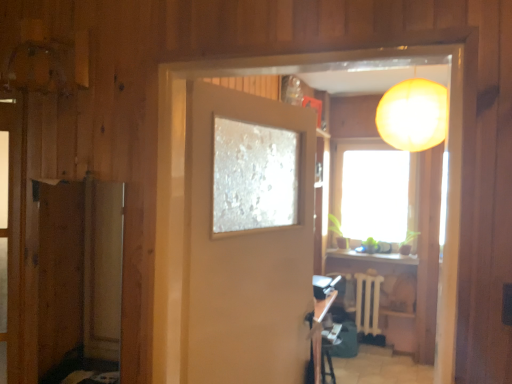
At what (x,y) coordinates should I click in order to perform the action: click on white plastic radiator at center. Please return your answer as a coordinate pair (x, y). This screenshot has width=512, height=384. Looking at the image, I should click on (367, 303).

Describe the element at coordinates (371, 190) in the screenshot. I see `transparent glass window at center` at that location.

Identify the location of wooden table at lower center. (319, 331).

Looking at their sizes, would you say matte orange lampshade at upper right is wider or thinner than wooden table at lower center?

In the image, matte orange lampshade at upper right appears to be wider than wooden table at lower center.

Is matte orange lampshade at upper right to the left or to the right of wooden table at lower center in the image?

In the image, matte orange lampshade at upper right appears on the right side of wooden table at lower center.

In terms of height, does matte orange lampshade at upper right look taller or shorter compared to wooden table at lower center?

Clearly, matte orange lampshade at upper right is taller compared to wooden table at lower center.

Looking at the image, does matte orange lampshade at upper right seem bigger or smaller compared to wooden table at lower center?

Considering their sizes, matte orange lampshade at upper right takes up more space than wooden table at lower center.

Is transparent glass window at center wider than white plastic radiator at center?

No.

Can we say transparent glass window at center lies outside white plastic radiator at center?

Yes.

From the image's perspective, who appears lower, transparent glass window at center or white plastic radiator at center?

white plastic radiator at center is shown below in the image.

Considering the points (378, 240) and (373, 331), which point is in front, point (378, 240) or point (373, 331)?

The point (373, 331) is closer.

Considering the positions of points (326, 312) and (406, 102), is point (326, 312) farther from camera compared to point (406, 102)?

Yes, it is.

From a real-world perspective, is wooden table at lower center over matte orange lampshade at upper right?

No.

Is the depth of wooden table at lower center greater than that of matte orange lampshade at upper right?

Yes, wooden table at lower center is further from the viewer.

Is wooden table at lower center looking in the opposite direction of matte orange lampshade at upper right?

No, wooden table at lower center's orientation is not away from matte orange lampshade at upper right.

From the picture: Are matte orange lampshade at upper right and wooden screen door at left located far from each other?

matte orange lampshade at upper right is far away from wooden screen door at left.

Can you confirm if matte orange lampshade at upper right is taller than wooden screen door at left?

Yes.

Does matte orange lampshade at upper right come behind wooden screen door at left?

Yes, the depth of matte orange lampshade at upper right is greater than that of wooden screen door at left.

How different are the orientations of matte orange lampshade at upper right and wooden screen door at left in degrees?

4.07 degrees.

Is wooden screen door at left facing towards white plastic radiator at center?

No, wooden screen door at left is not facing towards white plastic radiator at center.

Which object is closer to the camera, wooden screen door at left or white plastic radiator at center?

Positioned in front is wooden screen door at left.

Looking at this image, do you think wooden screen door at left is within white plastic radiator at center, or outside of it?

wooden screen door at left lies outside white plastic radiator at center.

Is wooden table at lower center far away from wooden screen door at left?

Yes, wooden table at lower center and wooden screen door at left are quite far apart.

Considering the sizes of wooden table at lower center and wooden screen door at left in the image, is wooden table at lower center wider or thinner than wooden screen door at left?

wooden table at lower center is wider than wooden screen door at left.

From a real-world perspective, does wooden table at lower center stand above wooden screen door at left?

No, from a real-world perspective, wooden table at lower center is not above wooden screen door at left.

Considering the sizes of matte orange lampshade at upper right and matte beige door at center in the image, is matte orange lampshade at upper right taller or shorter than matte beige door at center?

Considering their sizes, matte orange lampshade at upper right has less height than matte beige door at center.

Which object is positioned more to the right, matte orange lampshade at upper right or matte beige door at center?

Positioned to the right is matte orange lampshade at upper right.

Is point (431, 103) positioned before point (203, 244)?

No, it is not.

Where is `lamp to the right of wooden table at lower center`? Image resolution: width=512 pixels, height=384 pixels. lamp to the right of wooden table at lower center is located at coordinates (413, 114).

This screenshot has height=384, width=512. I want to click on radiator in front of the transparent glass window at center, so click(x=367, y=303).

When comparing their distances from wooden screen door at left, does matte orange lampshade at upper right or matte beige door at center seem closer?

matte beige door at center.

Based on their spatial positions, is wooden table at lower center or matte orange lampshade at upper right further from matte beige door at center?

→ matte orange lampshade at upper right is positioned further to the anchor matte beige door at center.

From the image, which object appears to be nearer to wooden table at lower center, transparent glass window at center or matte beige door at center?

Among the two, matte beige door at center is located nearer to wooden table at lower center.

Estimate the real-world distances between objects in this image. Which object is closer to white plastic radiator at center, wooden table at lower center or matte orange lampshade at upper right?

wooden table at lower center is positioned closer to the anchor white plastic radiator at center.

When comparing their distances from wooden screen door at left, does wooden table at lower center or transparent glass window at center seem closer?

wooden table at lower center is closer to wooden screen door at left.

Looking at the image, which one is located further to white plastic radiator at center, matte beige door at center or transparent glass window at center?

matte beige door at center lies further to white plastic radiator at center than the other object.

Estimate the real-world distances between objects in this image. Which object is closer to matte orange lampshade at upper right, wooden screen door at left or white plastic radiator at center?

The object closer to matte orange lampshade at upper right is wooden screen door at left.

Considering their positions, is matte beige door at center positioned further to wooden table at lower center than matte orange lampshade at upper right?

matte orange lampshade at upper right is further to wooden table at lower center.

Find the location of `table between matte beige door at center and white plastic radiator at center in the front-back direction`. table between matte beige door at center and white plastic radiator at center in the front-back direction is located at coordinates (319, 331).

The height and width of the screenshot is (384, 512). Find the location of `radiator between matte orange lampshade at upper right and wooden table at lower center in the up-down direction`. radiator between matte orange lampshade at upper right and wooden table at lower center in the up-down direction is located at coordinates (367, 303).

This screenshot has height=384, width=512. Find the location of `lamp between wooden screen door at left and white plastic radiator at center in the front-back direction`. lamp between wooden screen door at left and white plastic radiator at center in the front-back direction is located at coordinates (413, 114).

Locate an element on the screen. This screenshot has width=512, height=384. lamp between matte beige door at center and transparent glass window at center in the front-back direction is located at coordinates (413, 114).